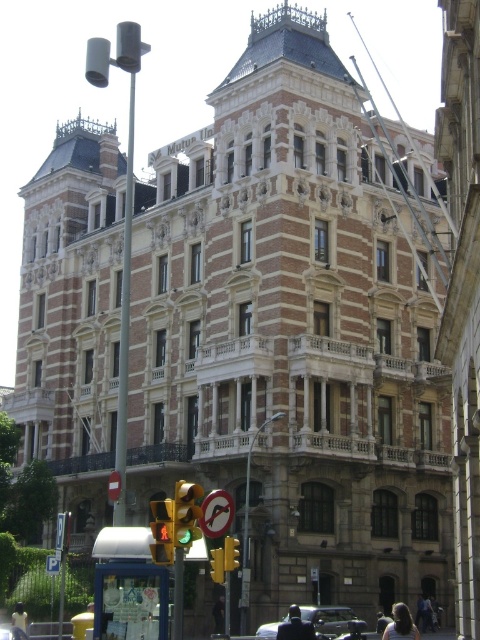
Question: Which object appears farthest from the camera in this image?

Choices:
 (A) yellow plastic traffic light at center
 (B) dark hair at center
 (C) metallic pole at left
 (D) yellow/glass traffic light at lower center

Answer: (B)

Question: Which point is farther from the camera taking this photo?

Choices:
 (A) (312, 618)
 (B) (57, 566)
 (C) (217, 577)
 (D) (197, 497)

Answer: (B)

Question: Does shiny black car at lower center have a lesser width compared to dark gray fabric jacket at lower center?

Choices:
 (A) yes
 (B) no

Answer: (A)

Question: Can you confirm if metallic pole at left is positioned to the left of shiny black car at lower center?

Choices:
 (A) no
 (B) yes

Answer: (B)

Question: Which object is positioned farthest from the green glass traffic light at lower left?

Choices:
 (A) yellow plastic traffic light at center
 (B) shiny black car at lower center

Answer: (B)

Question: Is dark brown hair at center behind light brown hair at lower left?

Choices:
 (A) yes
 (B) no

Answer: (B)